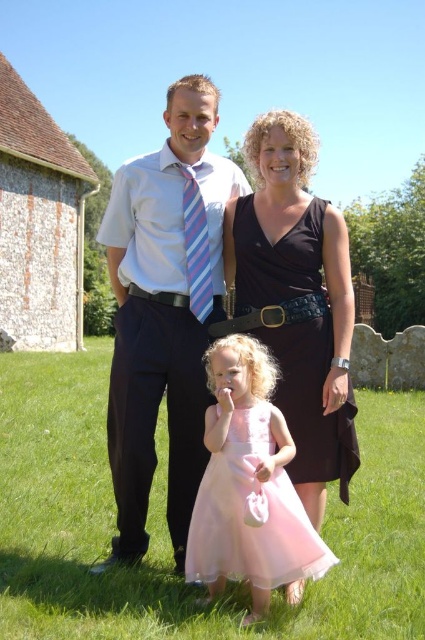
Question: Which point is farther to the camera?

Choices:
 (A) pink satin dress at center
 (B) white shirt at center

Answer: (B)

Question: Which object is farther from the camera taking this photo?

Choices:
 (A) black satin dress at center
 (B) striped fabric tie at center
 (C) green grass at lower center

Answer: (B)

Question: Does black satin dress at center have a lesser width compared to pink satin dress at center?

Choices:
 (A) yes
 (B) no

Answer: (B)

Question: Is black satin dress at center closer to camera compared to striped fabric tie at center?

Choices:
 (A) no
 (B) yes

Answer: (B)

Question: Can you confirm if green grass at lower center is wider than striped fabric tie at center?

Choices:
 (A) yes
 (B) no

Answer: (A)

Question: Which of these objects is positioned farthest from the green grass at lower center?

Choices:
 (A) white shirt at center
 (B) pink satin dress at center
 (C) black satin dress at center

Answer: (C)